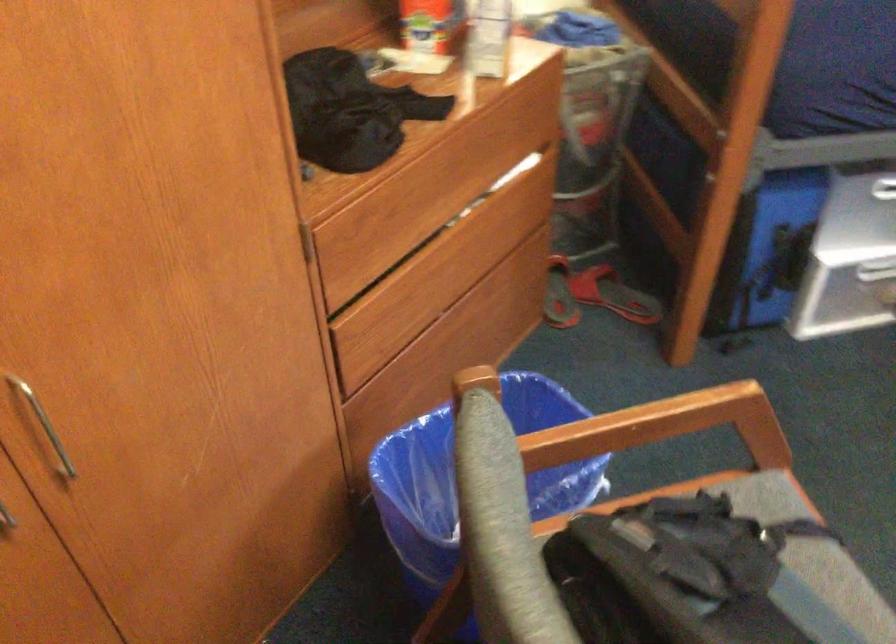
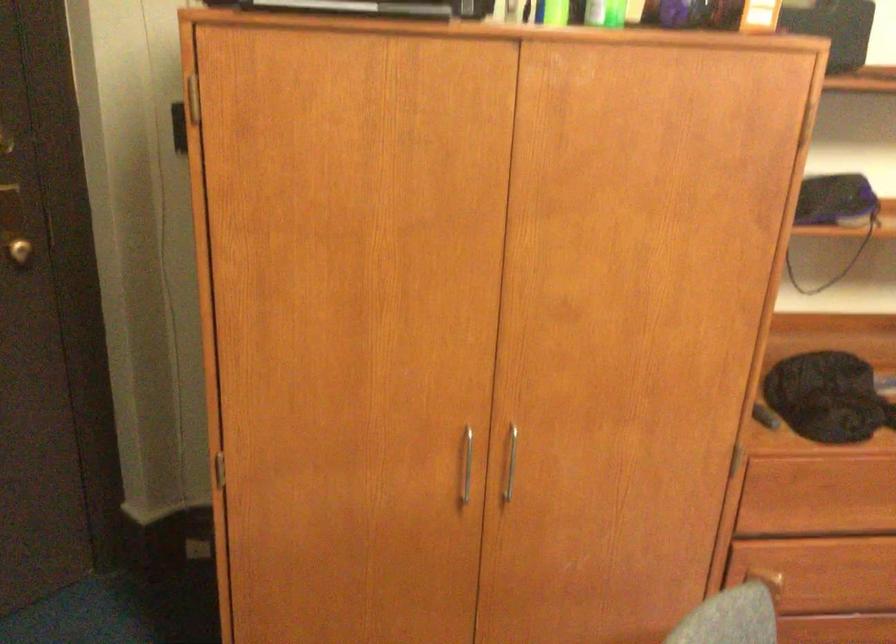
Question: The camera is either moving clockwise (left) or counter-clockwise (right) around the object. The first image is from the beginning of the video and the second image is from the end. Is the camera moving left or right when shooting the video?

Choices:
 (A) Left
 (B) Right

Answer: (B)